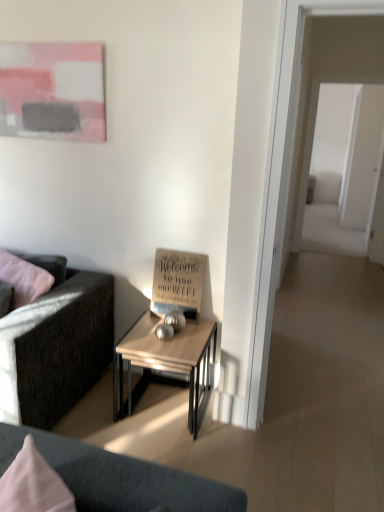
This screenshot has height=512, width=384. What are the coordinates of `matte pink painting at upper left` in the screenshot? It's located at (53, 91).

You are a GUI agent. You are given a task and a screenshot of the screen. Output one action in this format:
    pyautogui.click(x=<x>, y=<y>)
    Task: Click on the wooden sign at center
    
    Given the screenshot: What is the action you would take?
    pyautogui.click(x=178, y=278)

Is transparent glass door at right not close to wooden table at center?

Yes.

Which object is further away from the camera taking this photo, transparent glass door at right or wooden table at center?

transparent glass door at right is further away from the camera.

How far apart are transparent glass door at right and wooden table at center?

10.61 feet.

This screenshot has height=512, width=384. What are the coordinates of `glass door that appears above the dark gray fabric couch at left (from a real-world perspective)` in the screenshot? It's located at [312, 142].

Is transparent glass door at right aimed at dark gray fabric couch at left?

No, transparent glass door at right is not facing towards dark gray fabric couch at left.

Is dark gray fabric couch at left to the left of matte pink painting at upper left from the viewer's perspective?

Correct, you'll find dark gray fabric couch at left to the left of matte pink painting at upper left.

From the image's perspective, between dark gray fabric couch at left and matte pink painting at upper left, who is located below?

dark gray fabric couch at left.

Does dark gray fabric couch at left have a lesser height compared to matte pink painting at upper left?

No.

Looking at their sizes, would you say transparent glass door at right is wider or thinner than wooden sign at center?

Considering their sizes, transparent glass door at right looks broader than wooden sign at center.

From the image's perspective, which is below, transparent glass door at right or wooden sign at center?

wooden sign at center appears lower in the image.

Consider the image. Who is bigger, transparent glass door at right or wooden sign at center?

transparent glass door at right.

Between matte pink painting at upper left and wooden sign at center, which one has less height?

Standing shorter between the two is wooden sign at center.

Which is more to the left, matte pink painting at upper left or wooden sign at center?

matte pink painting at upper left.

Are matte pink painting at upper left and wooden sign at center located far from each other?

Yes, matte pink painting at upper left and wooden sign at center are located far from each other.

Considering their positions, is matte pink painting at upper left located in front of or behind wooden sign at center?

In the image, matte pink painting at upper left appears in front of wooden sign at center.

Does wooden sign at center have a larger size compared to transparent glass door at right?

Incorrect, wooden sign at center is not larger than transparent glass door at right.

Between wooden sign at center and transparent glass door at right, which one is positioned behind?

transparent glass door at right is further away from the camera.

Is wooden sign at center oriented away from transparent glass door at right?

Yes, wooden sign at center's orientation is away from transparent glass door at right.

Considering the points (183, 257) and (315, 82), which point is behind, point (183, 257) or point (315, 82)?

The point (315, 82) is farther.

Can you confirm if dark gray fabric couch at left is wider than transparent glass door at right?

Indeed, dark gray fabric couch at left has a greater width compared to transparent glass door at right.

The height and width of the screenshot is (512, 384). In the image, there is a transparent glass door at right. What are the coordinates of `studio couch below it (from the image's perspective)` in the screenshot? It's located at (55, 345).

From the image's perspective, is dark gray fabric couch at left under transparent glass door at right?

Yes, from the image's perspective, dark gray fabric couch at left is beneath transparent glass door at right.

Can you confirm if dark gray fabric couch at left is positioned to the right of transparent glass door at right?

In fact, dark gray fabric couch at left is to the left of transparent glass door at right.

I want to click on table that appears on the left of transparent glass door at right, so click(x=169, y=361).

I want to click on studio couch below the transparent glass door at right (from the image's perspective), so click(x=55, y=345).

Based on their spatial positions, is transparent glass door at right or wooden table at center further from dark gray fabric couch at left?

Among the two, transparent glass door at right is located further to dark gray fabric couch at left.

Looking at the image, which one is located further to dark gray fabric couch at left, wooden table at center or transparent glass door at right?

transparent glass door at right lies further to dark gray fabric couch at left than the other object.

In the scene shown: Looking at the image, which one is located further to wooden table at center, transparent glass door at right or wooden sign at center?

transparent glass door at right.

In the scene shown: Which object lies further to the anchor point matte pink painting at upper left, transparent glass door at right or wooden sign at center?

The object further to matte pink painting at upper left is transparent glass door at right.

Estimate the real-world distances between objects in this image. Which object is further from dark gray fabric couch at left, wooden table at center or wooden sign at center?

Among the two, wooden sign at center is located further to dark gray fabric couch at left.

Based on their spatial positions, is matte pink painting at upper left or dark gray fabric couch at left closer to transparent glass door at right?

matte pink painting at upper left is positioned closer to the anchor transparent glass door at right.

When comparing their distances from wooden table at center, does dark gray fabric couch at left or matte pink painting at upper left seem further?

matte pink painting at upper left.

From the image, which object appears to be farther from matte pink painting at upper left, wooden sign at center or wooden table at center?

wooden table at center lies further to matte pink painting at upper left than the other object.

Locate an element on the screen. writing between wooden table at center and transparent glass door at right from front to back is located at coordinates (178, 278).

Where is `picture frame between dark gray fabric couch at left and transparent glass door at right from left to right`? picture frame between dark gray fabric couch at left and transparent glass door at right from left to right is located at coordinates (53, 91).

Locate an element on the screen. writing that lies between matte pink painting at upper left and wooden table at center from top to bottom is located at coordinates (178, 278).

The height and width of the screenshot is (512, 384). I want to click on studio couch between matte pink painting at upper left and wooden table at center in the up-down direction, so click(x=55, y=345).